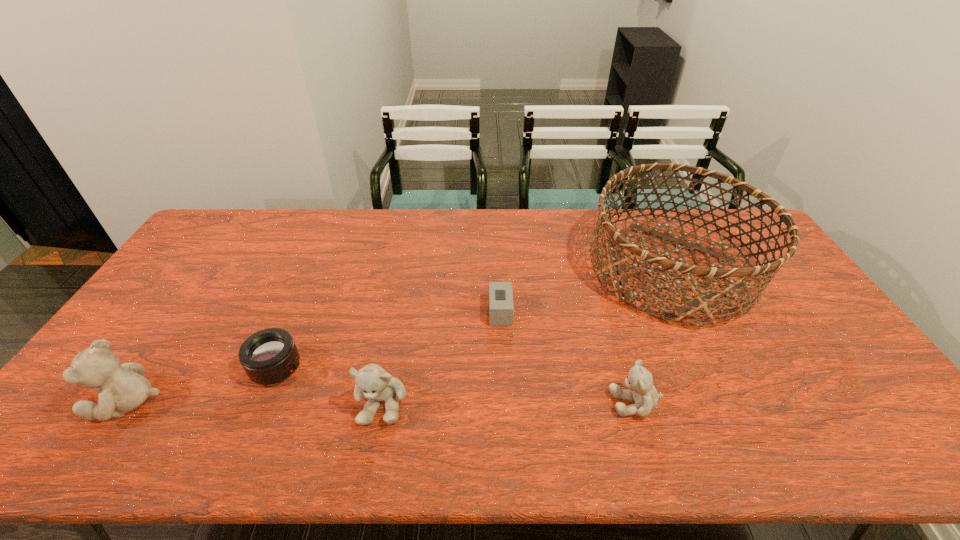
With all teddy bears evenly spaced, where should an extra teddy bear be placed on the right to continue the pattern? Please point out a vacant space. Please provide its 2D coordinates. Your answer should be formatted as a tuple, i.e. [(x, y)], where the tuple contains the x and y coordinates of a point satisfying the conditions above.

[(890, 403)]